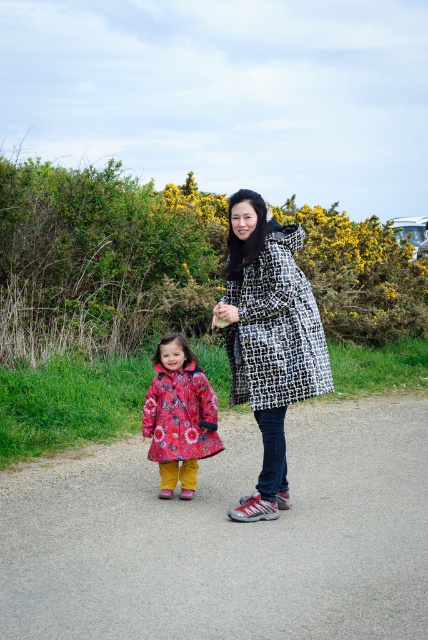
Question: Is gray asphalt path at center wider than floral-patterned coat at center?

Choices:
 (A) no
 (B) yes

Answer: (B)

Question: Does black and white checkered coat at center have a lesser width compared to floral-patterned coat at center?

Choices:
 (A) no
 (B) yes

Answer: (A)

Question: Observing the image, what is the correct spatial positioning of gray asphalt path at center in reference to floral-patterned coat at center?

Choices:
 (A) below
 (B) above

Answer: (A)

Question: Which point appears farthest from the camera in this image?

Choices:
 (A) click(x=291, y=589)
 (B) click(x=152, y=435)
 (C) click(x=246, y=285)

Answer: (B)

Question: Which point is farther from the camera taking this photo?

Choices:
 (A) (273, 401)
 (B) (404, 632)

Answer: (A)

Question: Among these objects, which one is farthest from the camera?

Choices:
 (A) gray asphalt path at center
 (B) black and white checkered coat at center

Answer: (B)